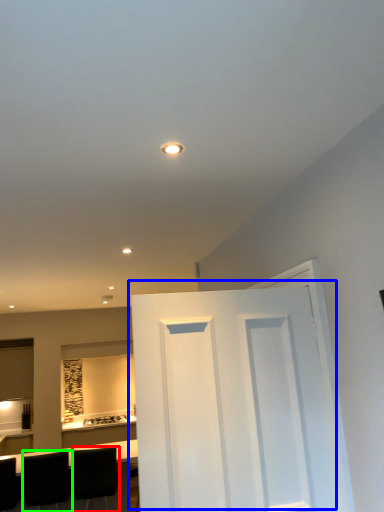
Question: Which object is the farthest from chair (highlighted by a red box)? Choose among these: door (highlighted by a blue box) or chair (highlighted by a green box).

Choices:
 (A) door
 (B) chair

Answer: (A)